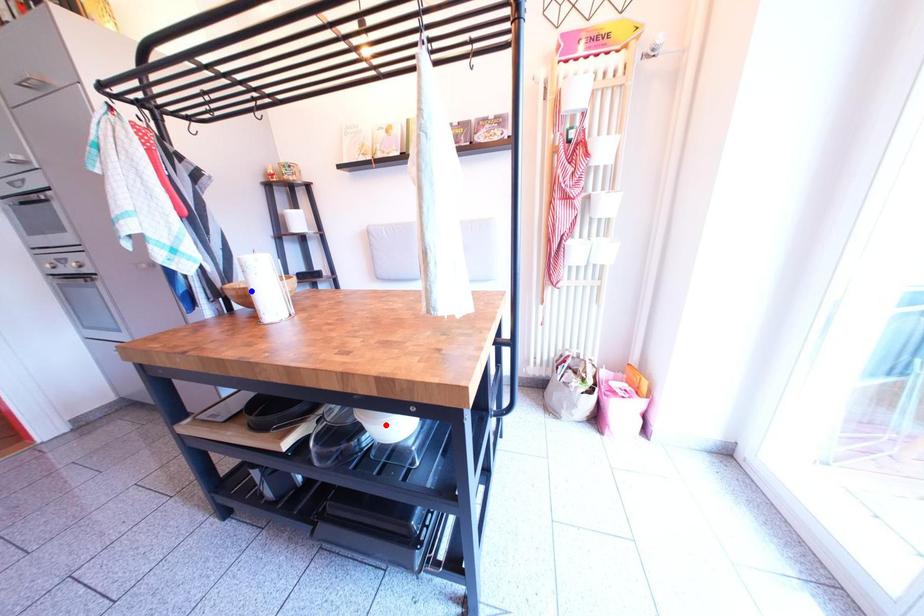
Question: Which of the two points in the image is closer to the camera?

Choices:
 (A) Blue point is closer.
 (B) Red point is closer.

Answer: (B)